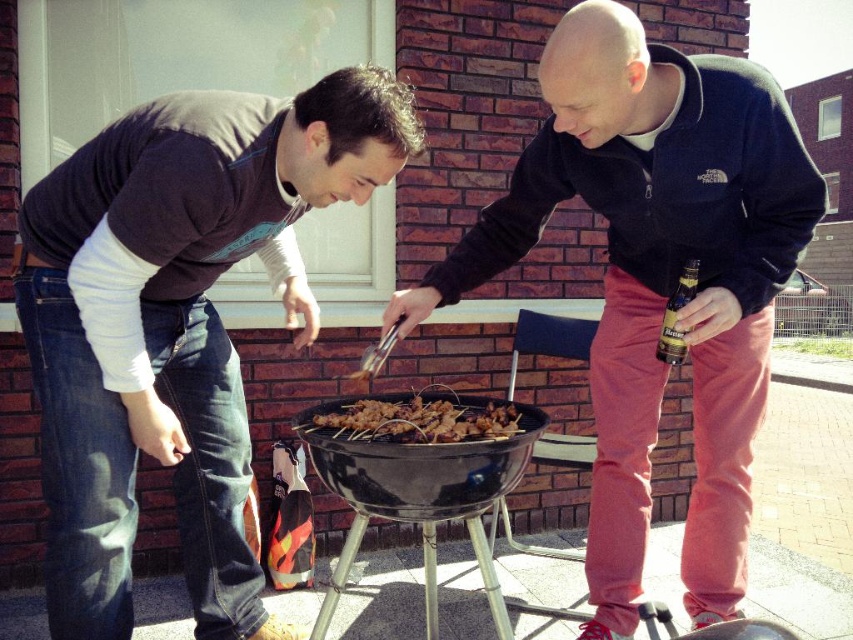
Question: Which object is the farthest from the matte black shirt at center?

Choices:
 (A) brown glossy skewers at center
 (B) matte black grill at center

Answer: (B)

Question: Which of these objects is positioned closest to the matte black shirt at center?

Choices:
 (A) black matte barbecue grill at center
 (B) brown glossy skewers at center
 (C) matte black grill at center

Answer: (A)

Question: Is matte black grill at center positioned behind black matte barbecue grill at center?

Choices:
 (A) no
 (B) yes

Answer: (B)

Question: Is matte black grill at center wider than black matte barbecue grill at center?

Choices:
 (A) yes
 (B) no

Answer: (A)

Question: Among these points, which one is nearest to the camera?

Choices:
 (A) click(421, 460)
 (B) click(374, 436)
 (C) click(560, 170)
 (D) click(190, 476)

Answer: (A)

Question: Does matte black shirt at center have a smaller size compared to brown glossy skewers at center?

Choices:
 (A) yes
 (B) no

Answer: (B)